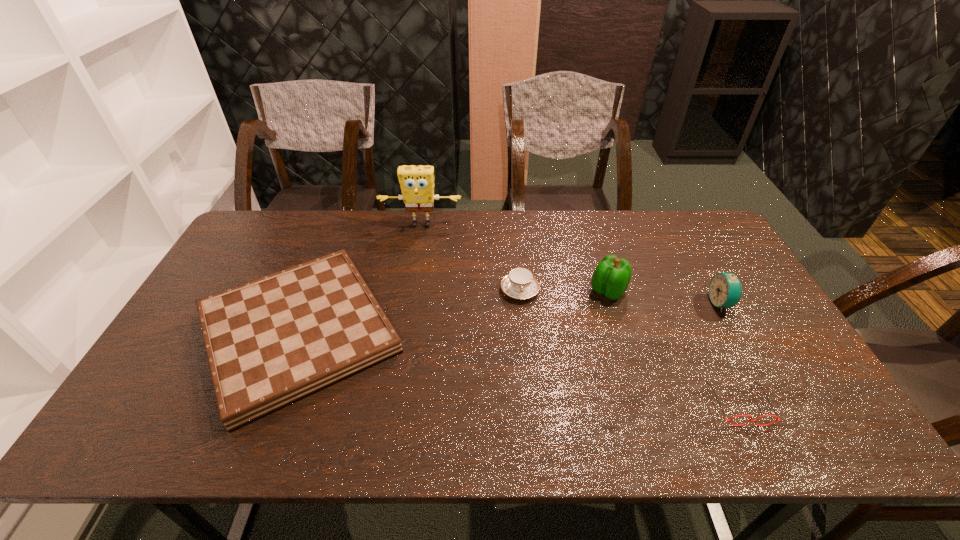
What are the coordinates of `object located at the near left corner` in the screenshot? It's located at (273, 341).

Identify the location of object that is at the near right corner. (755, 421).

This screenshot has width=960, height=540. Identify the location of vacant space at the far edge. (527, 230).

Image resolution: width=960 pixels, height=540 pixels. I want to click on vacant region at the near edge of the desktop, so click(553, 430).

In the image, there is a desktop. At what (x,y) coordinates should I click in order to perform the action: click on vacant space at the left edge. Please return your answer as a coordinate pair (x, y). The image size is (960, 540). Looking at the image, I should click on pos(252,279).

This screenshot has height=540, width=960. In the image, there is a desktop. Identify the location of free region at the right edge. (768, 339).

This screenshot has width=960, height=540. Identify the location of vacant space at the far left corner of the desktop. (234, 251).

The width and height of the screenshot is (960, 540). In the image, there is a desktop. Find the location of `vacant space at the near left corner`. vacant space at the near left corner is located at coordinates (137, 447).

I want to click on unoccupied position between the third object from left to right and the fourth object from left to right, so click(x=564, y=291).

Where is `unoccupied area between the third object from left to right and the gameboard`? The height and width of the screenshot is (540, 960). unoccupied area between the third object from left to right and the gameboard is located at coordinates (409, 311).